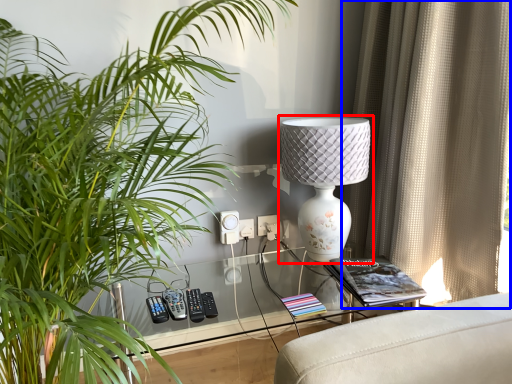
Question: Which point is closer to the camera, lamp (highlighted by a red box) or curtain (highlighted by a blue box)?

Choices:
 (A) lamp
 (B) curtain

Answer: (B)